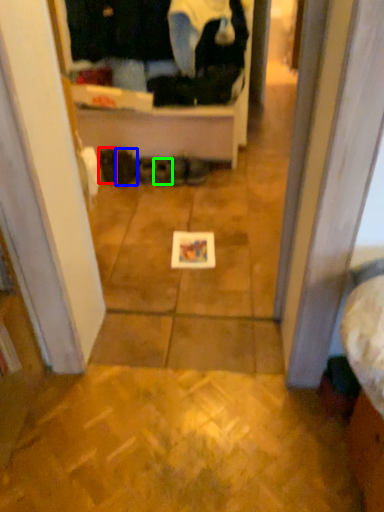
Question: Based on their relative distances, which object is farther from footwear (highlighted by a red box)? Choose from footwear (highlighted by a blue box) and footwear (highlighted by a green box).

Choices:
 (A) footwear
 (B) footwear

Answer: (B)